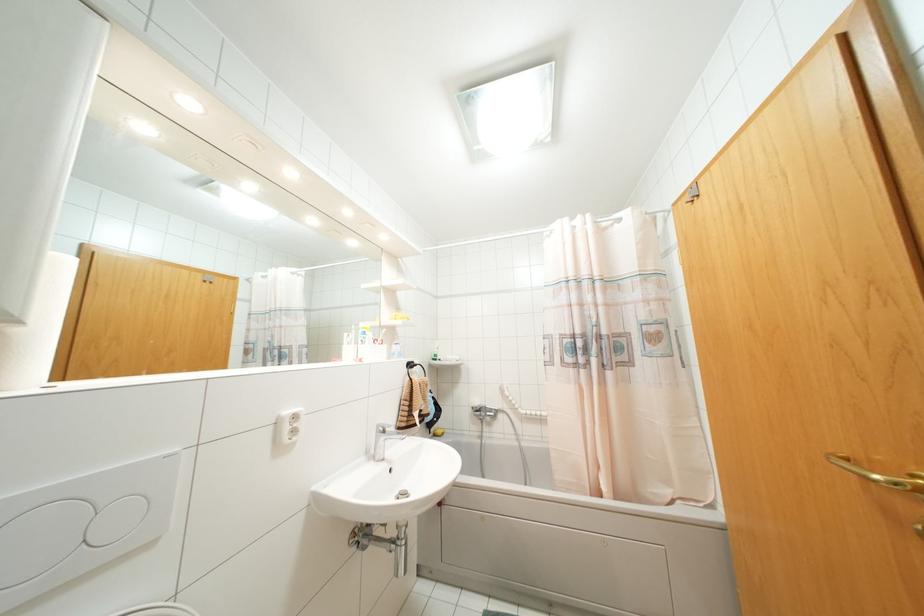
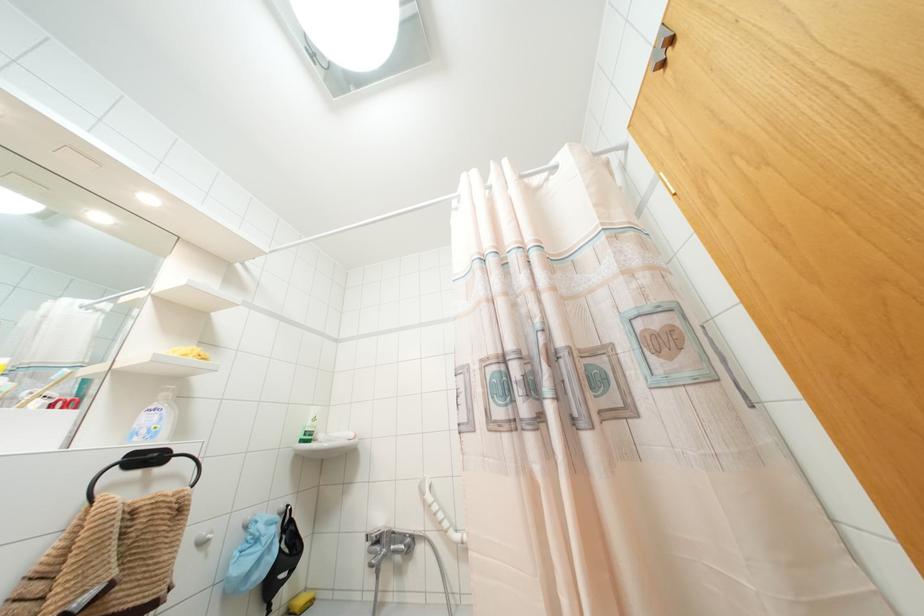
The point at (439, 431) is marked in the first image. Where is the corresponding point in the second image?

(299, 601)